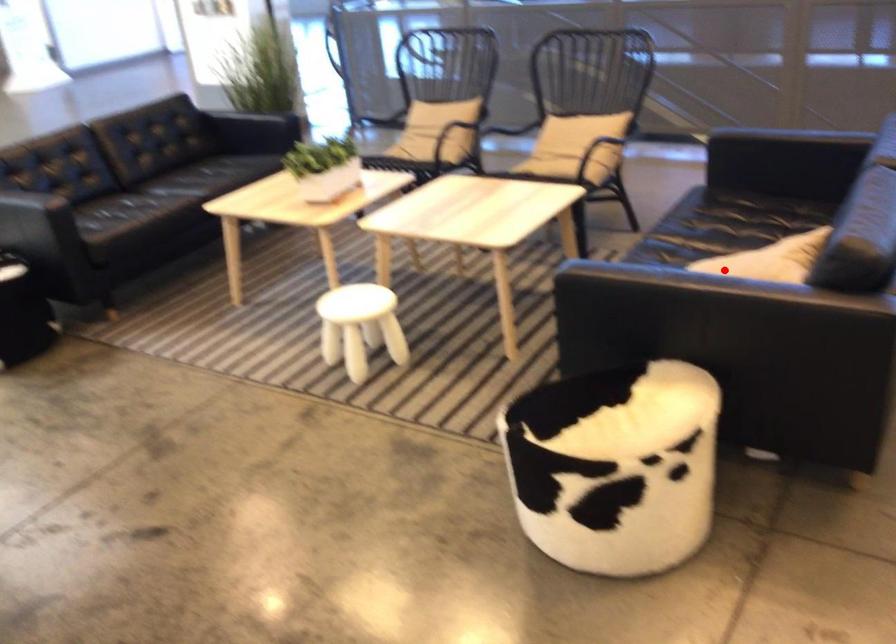
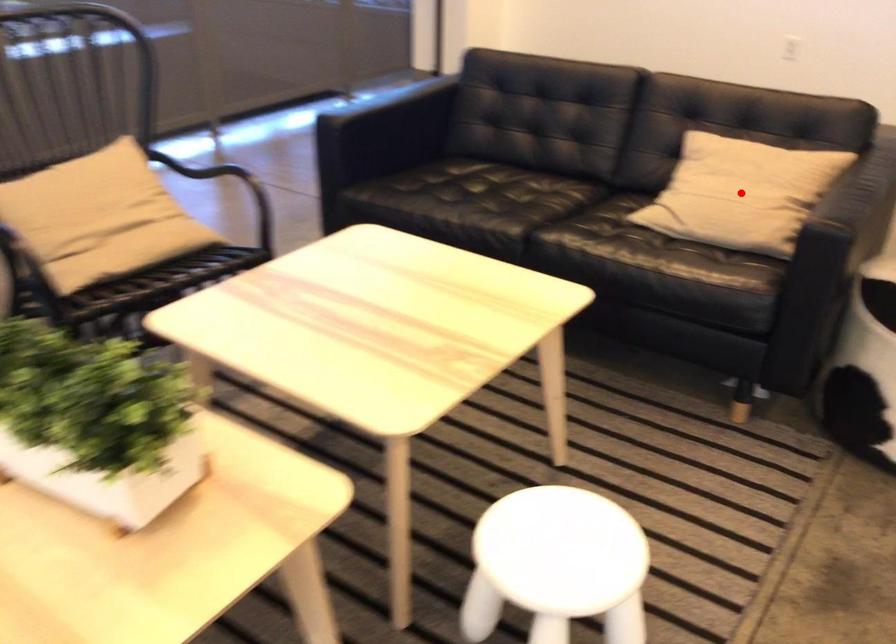
I am providing you with two images of the same scene from different viewpoints. A red point is marked on the first image and another point is marked on the second image. Are the points marked in image1 and image2 representing the same 3D position?

Yes